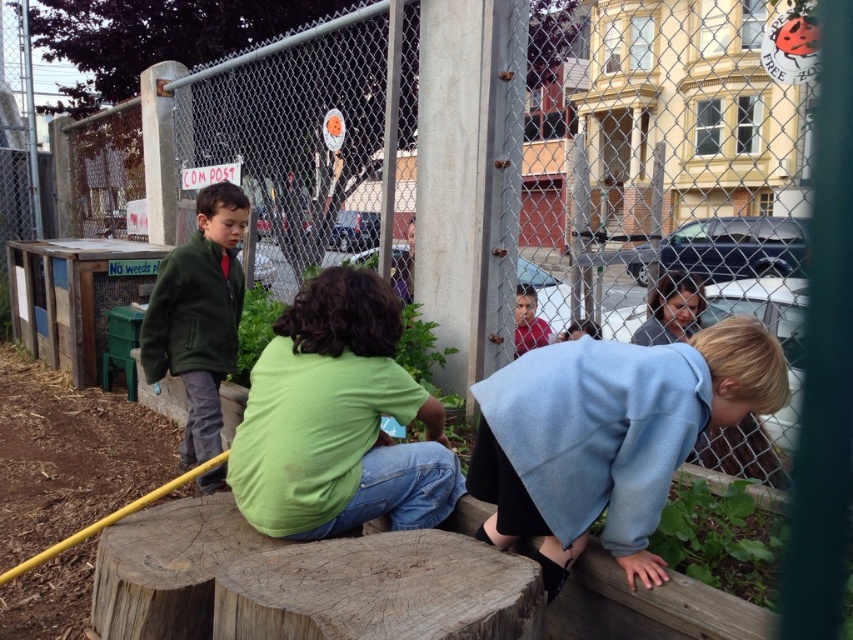
Can you confirm if green matte shirt at center is shorter than green fuzzy jacket at left?

Indeed, green matte shirt at center has a lesser height compared to green fuzzy jacket at left.

Does green matte shirt at center lie in front of green fuzzy jacket at left?

Yes.

Is point (250, 458) positioned in front of point (230, 348)?

Yes, point (250, 458) is in front of point (230, 348).

Locate an element on the screen. The height and width of the screenshot is (640, 853). green matte shirt at center is located at coordinates (337, 419).

Which of these two, light blue fleece jacket at lower right or green matte shirt at center, stands shorter?

light blue fleece jacket at lower right is shorter.

Between point (581, 509) and point (322, 474), which one is positioned in front?

Point (581, 509) is more forward.

Which is in front, point (680, 419) or point (372, 448)?

Point (680, 419)

I want to click on light blue fleece jacket at lower right, so click(x=608, y=436).

Who is more forward, (181, 312) or (529, 326)?

Positioned in front is point (181, 312).

Image resolution: width=853 pixels, height=640 pixels. I want to click on green fleece sweatshirt at left, so click(193, 310).

The width and height of the screenshot is (853, 640). Find the location of `green fleece sweatshirt at left`. green fleece sweatshirt at left is located at coordinates tap(193, 310).